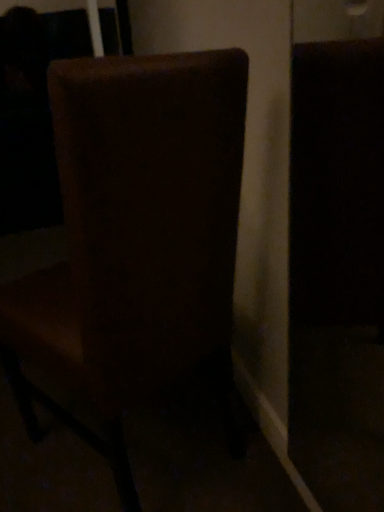
Question: Should I look upward or downward to see brown fabric chair at center?

Choices:
 (A) up
 (B) down

Answer: (B)